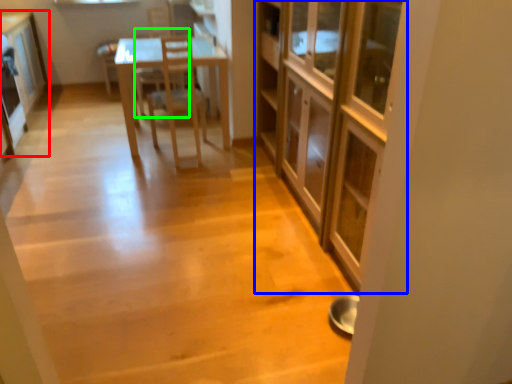
Question: Considering the real-world distances, which object is closest to cabinetry (highlighted by a red box)? cabinetry (highlighted by a blue box) or armchair (highlighted by a green box).

Choices:
 (A) cabinetry
 (B) armchair

Answer: (B)